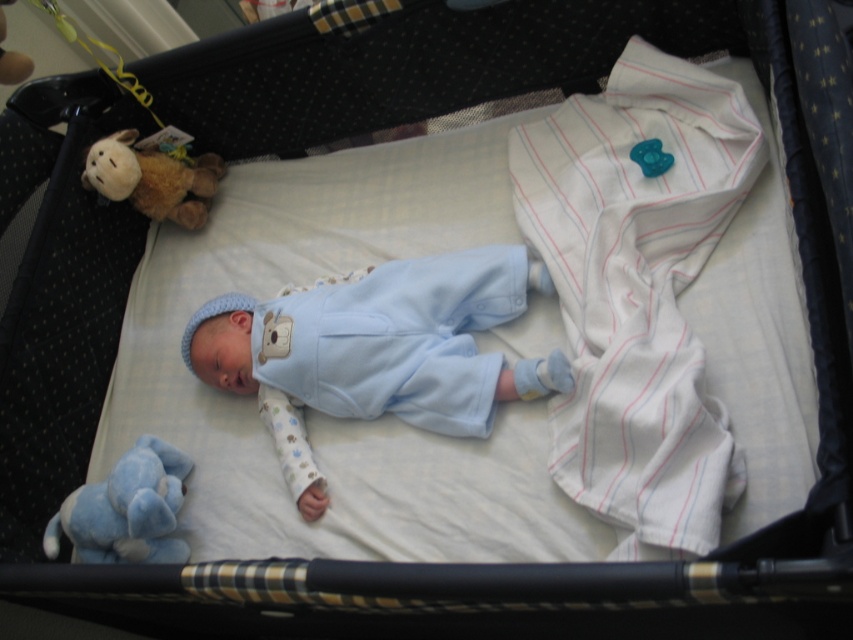
Question: Which object is positioned closest to the matte blue onesie at center?

Choices:
 (A) soft brown plush toy at upper left
 (B) soft plush toy at lower left

Answer: (B)

Question: Is the position of matte blue onesie at center less distant than that of soft plush toy at lower left?

Choices:
 (A) yes
 (B) no

Answer: (B)

Question: Is matte blue onesie at center to the right of soft plush toy at lower left from the viewer's perspective?

Choices:
 (A) no
 (B) yes

Answer: (B)

Question: Among these points, which one is farthest from the camera?

Choices:
 (A) (233, 310)
 (B) (129, 540)

Answer: (A)

Question: Which is farther from the matte blue onesie at center?

Choices:
 (A) soft brown plush toy at upper left
 (B) soft plush toy at lower left

Answer: (A)

Question: Does soft plush toy at lower left appear on the right side of soft brown plush toy at upper left?

Choices:
 (A) no
 (B) yes

Answer: (B)